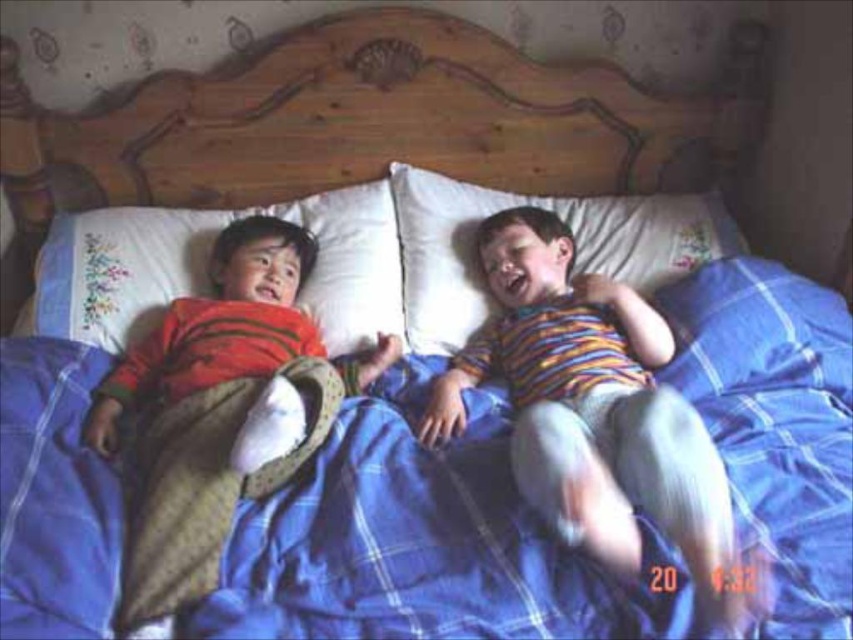
Question: Is wooden headboard at upper center above white embroidered pillow at upper left?

Choices:
 (A) yes
 (B) no

Answer: (A)

Question: Is blue plaid blanket at center to the left of striped cotton shirt at center from the viewer's perspective?

Choices:
 (A) no
 (B) yes

Answer: (B)

Question: Which object appears farthest from the camera in this image?

Choices:
 (A) white embroidered pillow at upper left
 (B) matte orange shirt at left
 (C) white soft pillow at center
 (D) wooden headboard at upper center

Answer: (D)

Question: Among these objects, which one is farthest from the camera?

Choices:
 (A) white embroidered pillow at upper left
 (B) matte orange shirt at left
 (C) white soft pillow at center
 (D) blue plaid blanket at center

Answer: (C)

Question: Can you confirm if wooden headboard at upper center is positioned to the right of striped cotton shirt at center?

Choices:
 (A) no
 (B) yes

Answer: (A)

Question: Among these objects, which one is farthest from the camera?

Choices:
 (A) striped cotton shirt at center
 (B) matte orange shirt at left
 (C) white embroidered pillow at upper left
 (D) wooden headboard at upper center

Answer: (D)